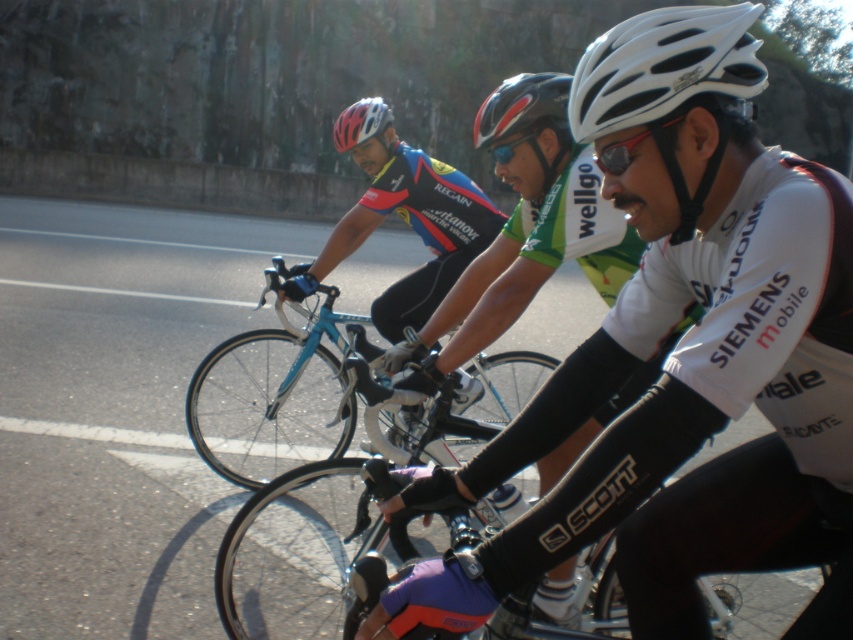
Question: Is glossy black helmet at center to the left of matte white helmet at upper center from the viewer's perspective?

Choices:
 (A) yes
 (B) no

Answer: (B)

Question: Is purple matte bicycle handlebar at center wider than shiny blue bicycle at center?

Choices:
 (A) yes
 (B) no

Answer: (B)

Question: Which of these objects is positioned closest to the white matte helmet at center?

Choices:
 (A) glossy black helmet at center
 (B) purple matte bicycle handlebar at center

Answer: (A)

Question: Which object appears closest to the camera in this image?

Choices:
 (A) purple matte bicycle handlebar at center
 (B) white matte bicycle helmet at center

Answer: (B)

Question: Does glossy black helmet at center appear under matte white helmet at upper center?

Choices:
 (A) yes
 (B) no

Answer: (B)

Question: Which object is the farthest from the glossy black helmet at center?

Choices:
 (A) purple matte bicycle handlebar at center
 (B) white matte bicycle helmet at center
 (C) matte white helmet at upper center
 (D) shiny blue bicycle at center

Answer: (B)